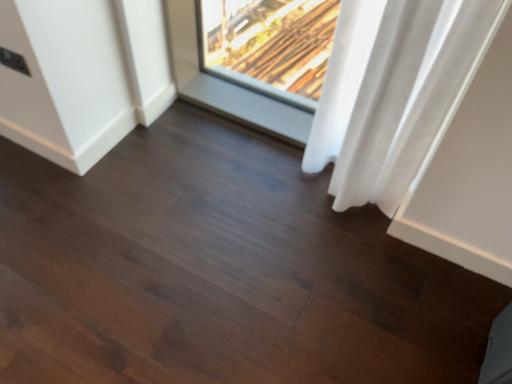
Locate an element on the screen. The image size is (512, 384). free space to the left of white sheer curtain at right is located at coordinates (276, 195).